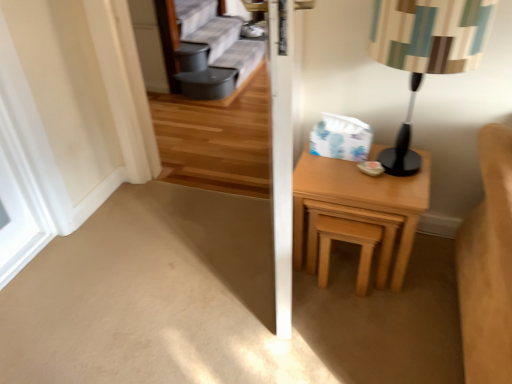
You are a GUI agent. You are given a task and a screenshot of the screen. Output one action in this format:
    pyautogui.click(x=<x>, y=<y>)
    Task: Click on the free space between light wood/texture nightstand at right and white matte window at left
    This screenshot has width=512, height=384.
    Given the screenshot: What is the action you would take?
    pyautogui.click(x=194, y=232)